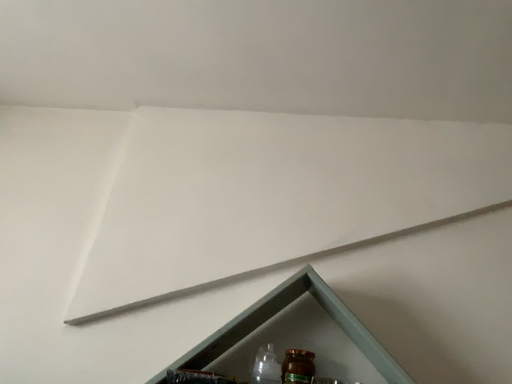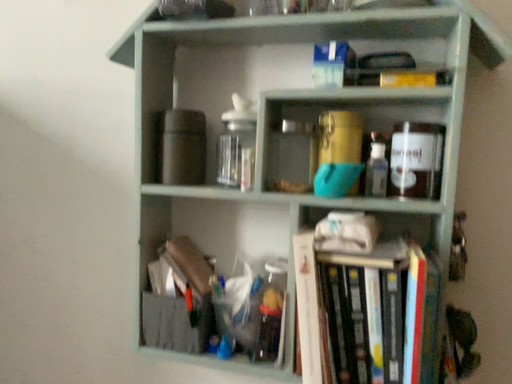
Question: Which way did the camera rotate in the video?

Choices:
 (A) rotated upward
 (B) rotated downward

Answer: (B)